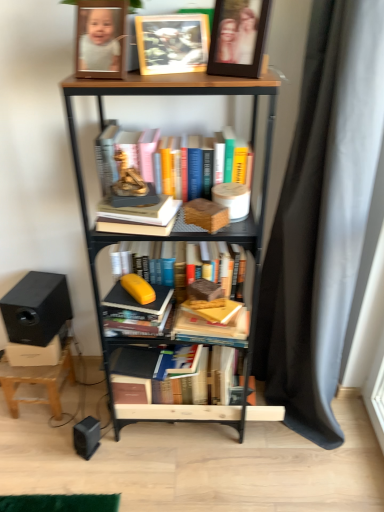
Image resolution: width=384 pixels, height=512 pixels. I want to click on free spot in front of wooden bookcase at center, so click(x=183, y=477).